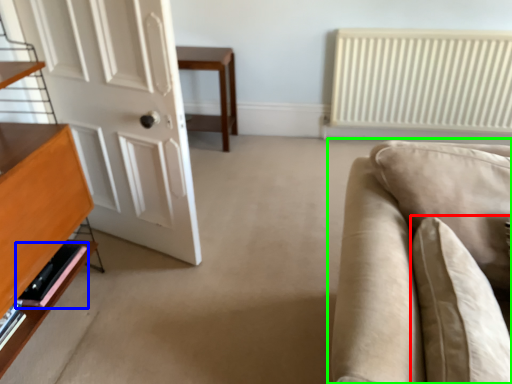
Question: Which is nearer to the pillow (highlighted by a red box)? shelf (highlighted by a blue box) or studio couch (highlighted by a green box).

Choices:
 (A) shelf
 (B) studio couch

Answer: (B)